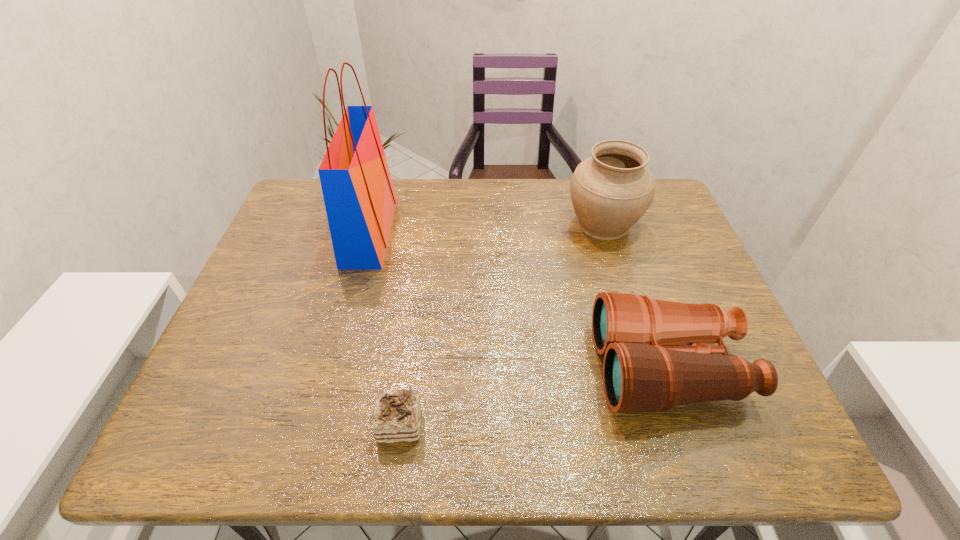
Find the location of a particular element. free space between the second object from left to right and the second tallest object is located at coordinates (501, 324).

At what (x,y) coordinates should I click in order to perform the action: click on empty space between the shopping bag and the binoculars. Please return your answer as a coordinate pair (x, y). Looking at the image, I should click on (x=519, y=300).

I want to click on unoccupied area between the third object from right to left and the second shortest object, so click(x=534, y=396).

Locate an element on the screen. This screenshot has width=960, height=540. object that can be found as the closest to the second shortest object is located at coordinates (610, 191).

At what (x,y) coordinates should I click in order to perform the action: click on the second closest object to the urn. Please return your answer as a coordinate pair (x, y). This screenshot has height=540, width=960. Looking at the image, I should click on (359, 196).

This screenshot has width=960, height=540. I want to click on free location that satisfies the following two spatial constraints: 1. through the lenses of the third tallest object; 2. on the front side of the shortest object, so click(687, 424).

The height and width of the screenshot is (540, 960). Identify the location of vacant space that satisfies the following two spatial constraints: 1. on the handle side of the third object from right to left; 2. on the left side of the shopping bag. (319, 424).

This screenshot has width=960, height=540. I want to click on free space that satisfies the following two spatial constraints: 1. on the back side of the chocolate cake; 2. on the handle side of the tallest object, so click(425, 232).

Locate an element on the screen. This screenshot has width=960, height=540. free location that satisfies the following two spatial constraints: 1. on the back side of the urn; 2. on the right side of the chocolate cake is located at coordinates (426, 224).

The image size is (960, 540). In order to click on free region that satisfies the following two spatial constraints: 1. through the lenses of the third tallest object; 2. on the front side of the chocolate cake in this screenshot , I will do `click(687, 424)`.